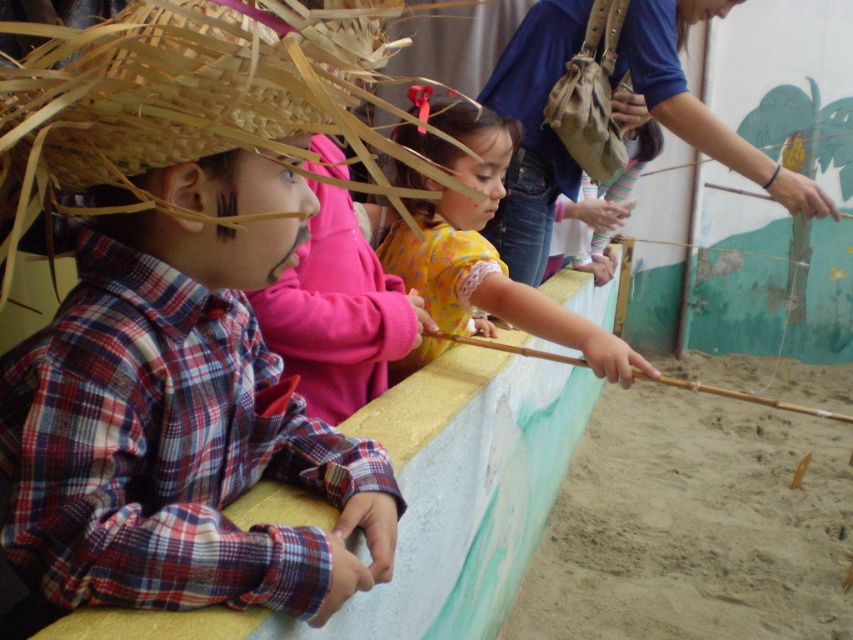
Question: Does fine-grained sand at lower right have a greater width compared to brown woven straw hat at left?

Choices:
 (A) yes
 (B) no

Answer: (A)

Question: Considering the real-world distances, which object is farthest from the brown wooden stick at center?

Choices:
 (A) plaid fabric shirt at left
 (B) fine-grained sand at lower right
 (C) yellow matte dress at center

Answer: (B)

Question: Which point is farther to the camera?

Choices:
 (A) (817, 605)
 (B) (717, 387)

Answer: (B)

Question: Does brown woven straw hat at left have a lesser width compared to brown wooden stick at center?

Choices:
 (A) yes
 (B) no

Answer: (A)

Question: Estimate the real-world distances between objects in this image. Which object is closer to the plaid fabric shirt at left?

Choices:
 (A) brown woven straw hat at left
 (B) brown wooden stick at center
 (C) fine-grained sand at lower right

Answer: (A)

Question: Observing the image, what is the correct spatial positioning of plaid fabric shirt at left in reference to yellow matte dress at center?

Choices:
 (A) below
 (B) above

Answer: (A)